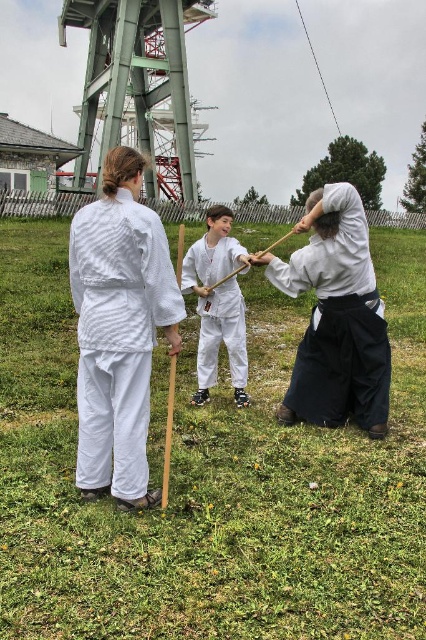
You are an observer standing at the edge of the park where the martial arts practice is taking place. You notice two individuals wearing white cotton kimono at center and white matte uniform at center. Which one is positioned more to the right side of the scene?

The white cotton kimono at center is positioned to the right of the white matte uniform at center, so the white cotton kimono at center is more to the right side of the scene.

You are standing at the point labeled as point (216,280) and want to throw a ball to the point labeled as point (124,484). Considering the positions of the two points, will the ball land closer to the person on the left or the person on the right?

The ball will land closer to the person on the left because point (124,484) is in front of point (216,280), meaning it is closer to the observer.